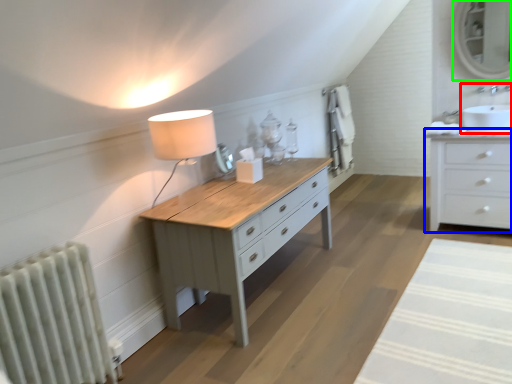
Question: Considering the real-world distances, which object is farthest from sink (highlighted by a red box)? chest of drawers (highlighted by a blue box) or mirror (highlighted by a green box)?

Choices:
 (A) chest of drawers
 (B) mirror

Answer: (B)